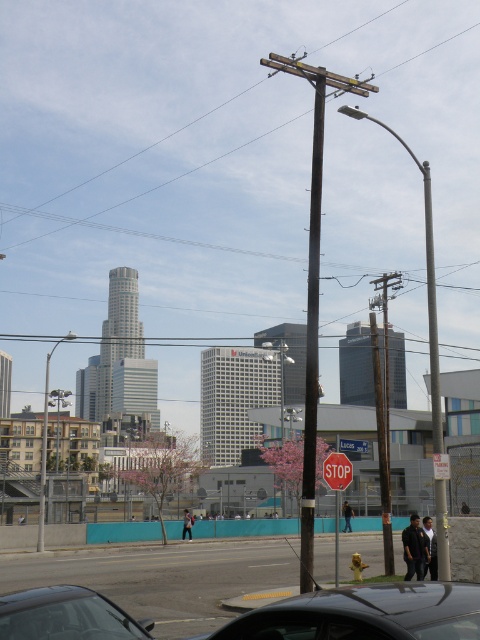
You are a delivery person who needs to load a tall package into your vehicle. The package is 2 meters in height. Based on the scene, can you safely load it into the black glossy car at lower center without damaging the brown wooden telegraph pole at center?

The black glossy car at lower center is not as tall as the brown wooden telegraph pole at center. Since the package is 2 meters tall, you need to ensure the car can accommodate it without hitting the pole. However, the description only states the car is shorter than the pole but does not provide exact measurements. Without knowing the exact height of the car or the distance between the car and the pole, it is uncertain if the package can be safely loaded. Proceed with caution and measure the space first.

You are a delivery driver who needs to park your vehicle in this area. You see the black glossy car at lower center and the brown wooden telegraph pole at center. Which object takes up more space in the parking spot?

The brown wooden telegraph pole at center takes up more space in the parking spot because the black glossy car at lower center has a smaller size compared to it.

You are a delivery driver who needs to know if your 2.5 meters wide truck can pass between the brown wooden telegraph pole at center and the red matte stop sign at center without touching either. Based on the scene, can you determine if there is enough space?

The brown wooden telegraph pole at center is wider than the red matte stop sign at center, but the exact distance between them isn